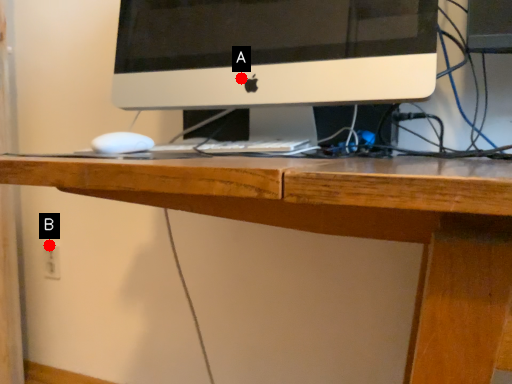
Question: Two points are circled on the image, labeled by A and B beside each circle. Which point is closer to the camera?

Choices:
 (A) A is closer
 (B) B is closer

Answer: (A)